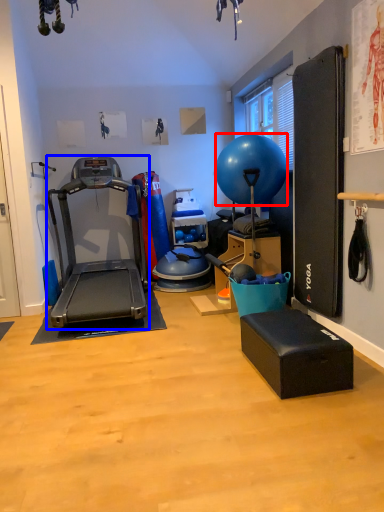
Question: Which object is further to the camera taking this photo, ball (highlighted by a red box) or treadmill (highlighted by a blue box)?

Choices:
 (A) ball
 (B) treadmill

Answer: (A)